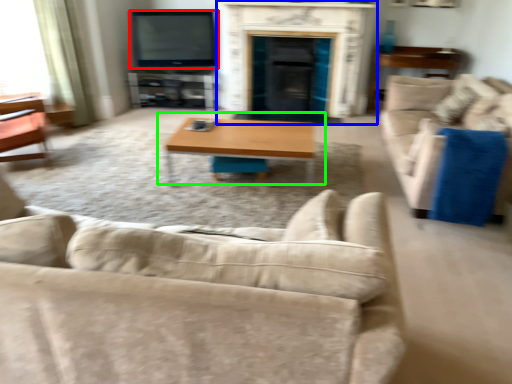
Question: Based on their relative distances, which object is nearer to television (highlighted by a red box)? Choose from fireplace (highlighted by a blue box) and coffee table (highlighted by a green box).

Choices:
 (A) fireplace
 (B) coffee table

Answer: (A)